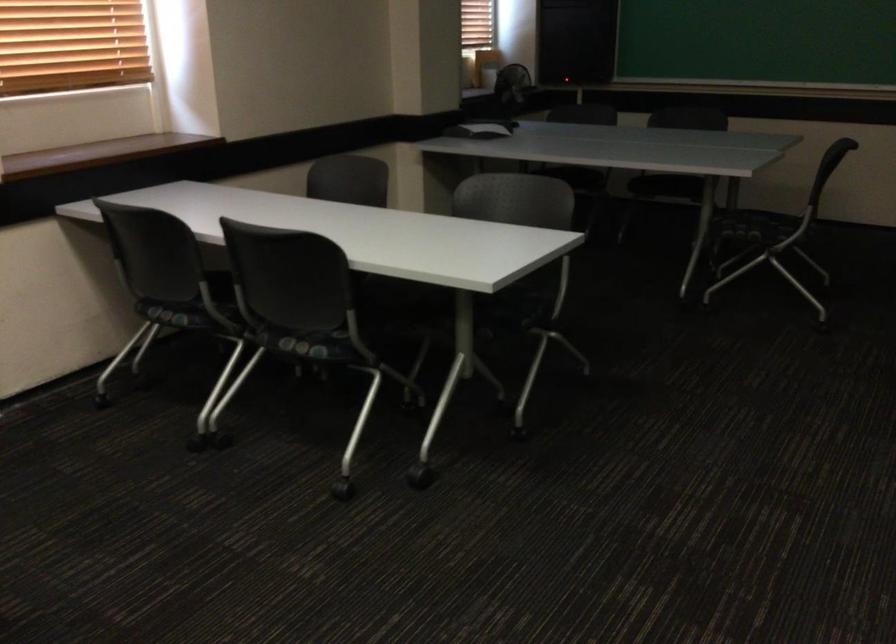
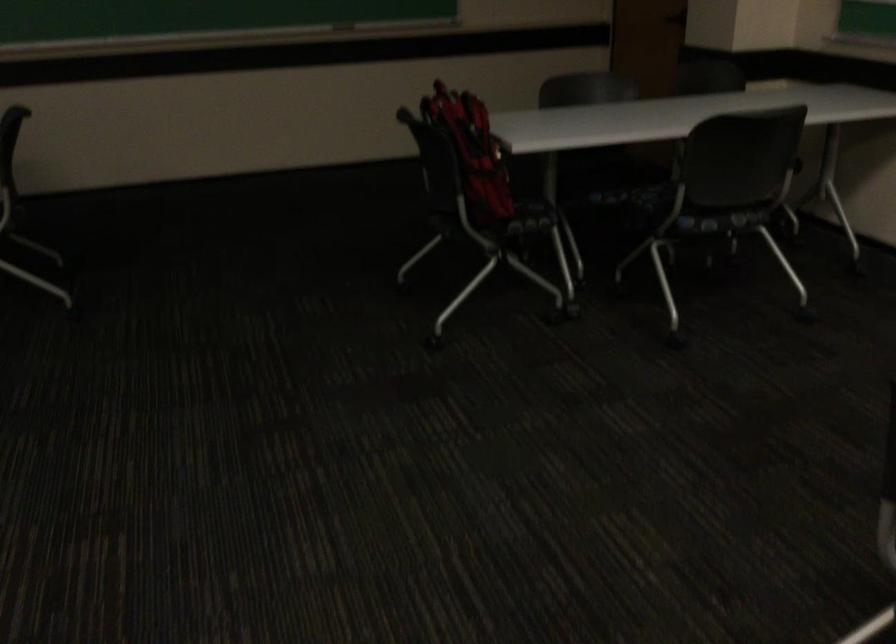
Question: The camera is either moving clockwise (left) or counter-clockwise (right) around the object. The first image is from the beginning of the video and the second image is from the end. Is the camera moving left or right when shooting the video?

Choices:
 (A) Left
 (B) Right

Answer: (A)